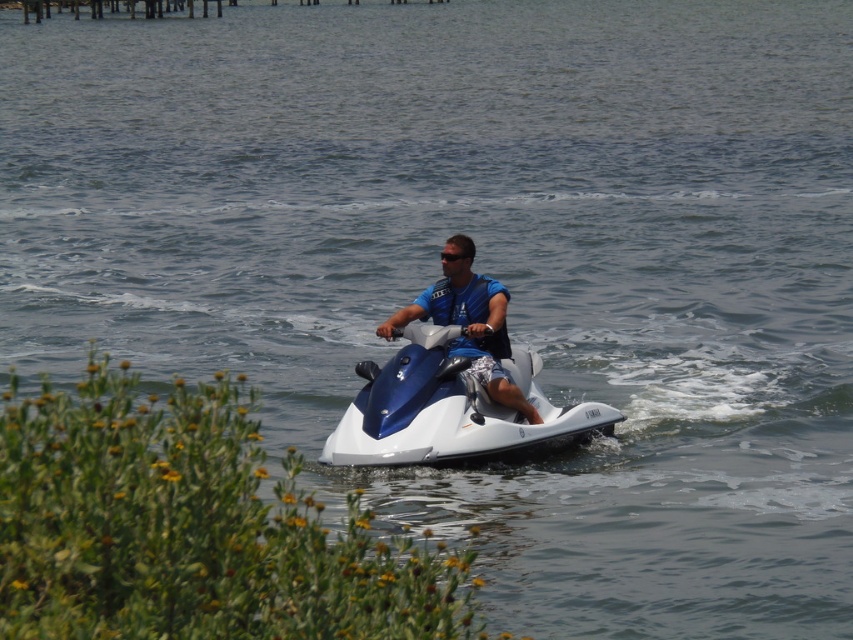
Question: Among these objects, which one is nearest to the camera?

Choices:
 (A) blue matte life vest at center
 (B) blue glossy snowmobile at center

Answer: (B)

Question: Is blue glossy snowmobile at center smaller than blue matte life vest at center?

Choices:
 (A) yes
 (B) no

Answer: (B)

Question: Which point is closer to the camera?

Choices:
 (A) blue glossy snowmobile at center
 (B) black plastic goggles at center

Answer: (A)

Question: Is blue matte life vest at center below black plastic goggles at center?

Choices:
 (A) no
 (B) yes

Answer: (B)

Question: Can you confirm if blue glossy snowmobile at center is positioned below blue matte life vest at center?

Choices:
 (A) yes
 (B) no

Answer: (A)

Question: Which point is farther from the camera taking this photo?

Choices:
 (A) (461, 284)
 (B) (460, 426)
 (C) (444, 259)

Answer: (C)